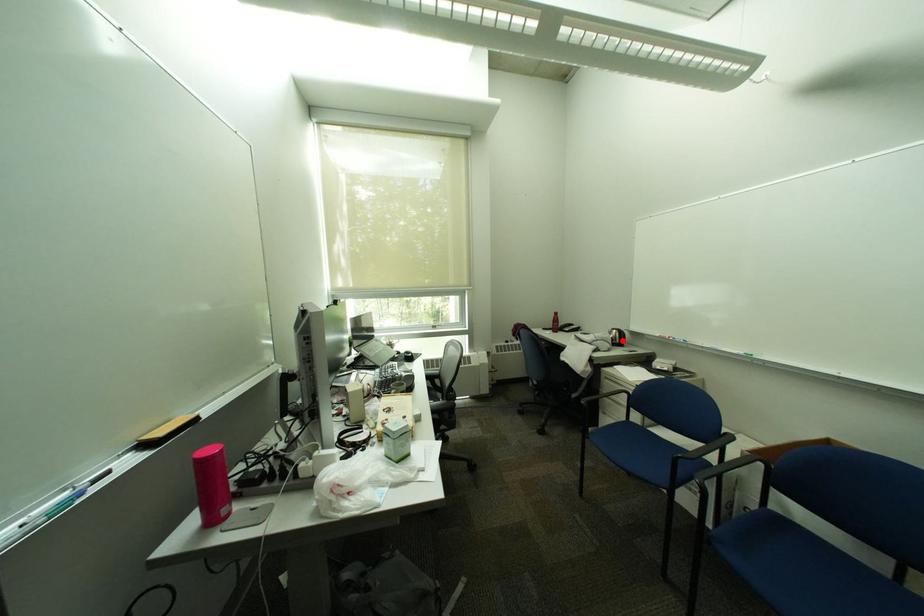
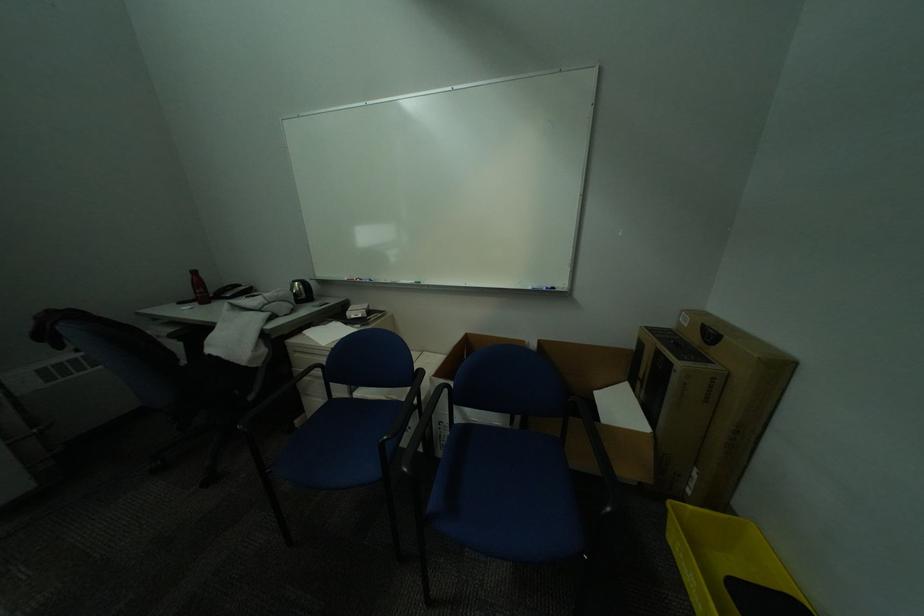
Question: I am providing you with two images of the same scene from different viewpoints. A red point is marked on the first image. Can you still see the location of the red point in image 2?

Choices:
 (A) Yes
 (B) No

Answer: (A)